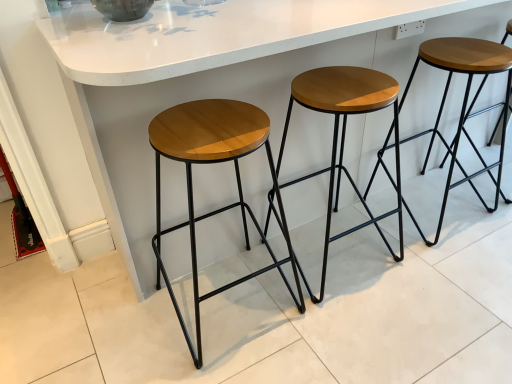
Locate an element on the screen. The image size is (512, 384). vacant area that lies between wooden/matte stool at center, marked as the 2th stool in a left-to-right arrangement, and wooden seat at center, acting as the 3th stool starting from the left is located at coordinates (383, 230).